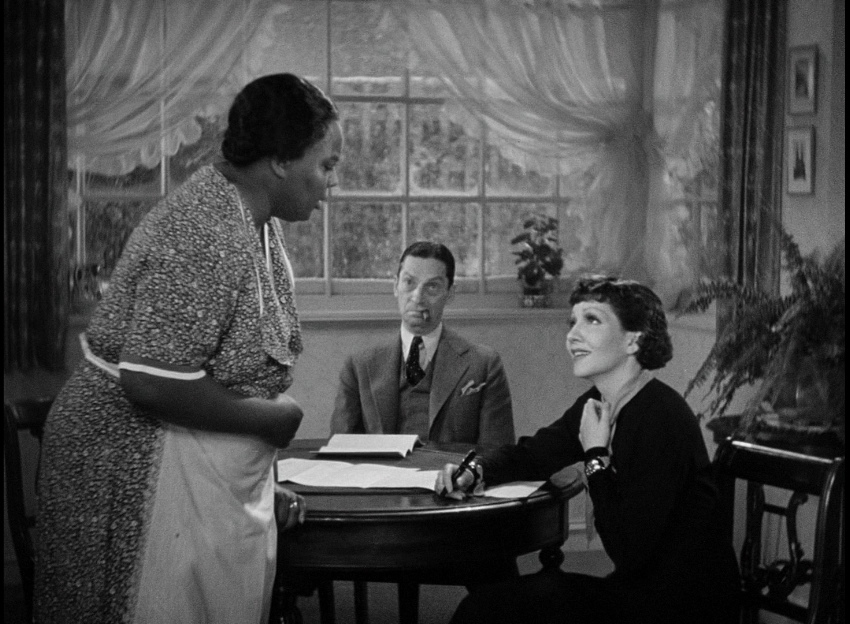
Find the location of a particular element. table is located at coordinates (347, 505).